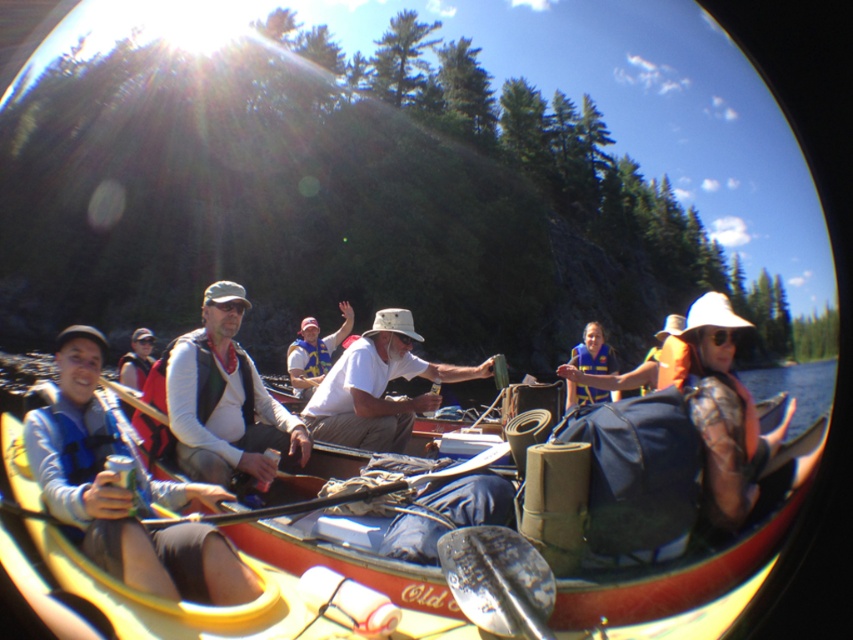
You are a photographer trying to capture the yellow plastic canoe at lower left and the matte blue life vest at left in the same frame. Based on their positions, which object is closer to the bottom edge of the image?

The yellow plastic canoe at lower left is closer to the bottom edge of the image because it is located below the matte blue life vest at left.

You are a safety inspector checking the canoe. You notice an object at point (224, 397). What is it?

The object at point (224, 397) is a white matte vest at center.

Looking at this image, you are a safety inspector checking the canoe for proper equipment. You notice two life vests in the canoe, the white life vest at center and the blue life vest at center. Which one has a smaller width?

The white life vest at center has a lesser width compared to the blue life vest at center.